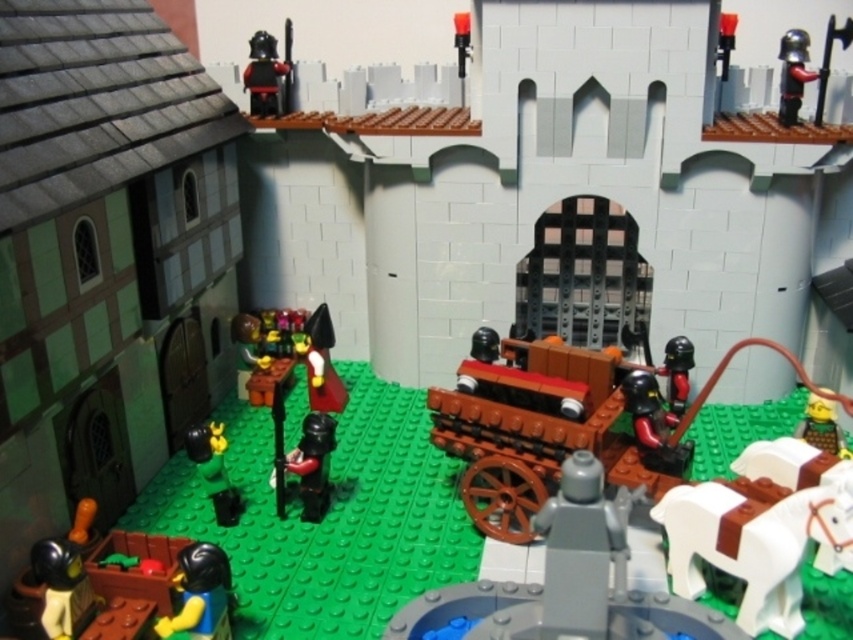
You are a Lego figure trying to hide behind an object. You have the option to hide behind either the brown matte horse at center or the shiny yellow helmet at lower left. Which object would provide better cover based on their sizes?

The brown matte horse at center is larger in size than the shiny yellow helmet at lower left, so it would provide better cover for hiding.

You are a Lego figure standing at the base of the castle walls. You need to reach the shiny yellow helmet at lower left, but there is a brown matte horse at center in your way. Can you easily walk around the horse to get to the helmet?

The brown matte horse at center is much taller than the shiny yellow helmet at lower left, so it might block your path. However, since the horse is taller, you can likely walk around it as long as there is enough space on either side of the horse to navigate towards the helmet.

You are a Lego figure standing at the position of point [589,394]. You want to move to the position of point [225,584]. Which direction should you move to get closer to your destination?

You should move downward and to the right because point [225,584] is located below and to the right of point [589,394].